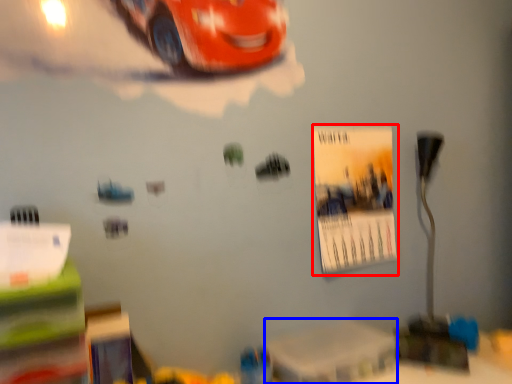
Question: Which of the following is the closest to the observer, poster page (highlighted by a red box) or table (highlighted by a blue box)?

Choices:
 (A) poster page
 (B) table

Answer: (B)